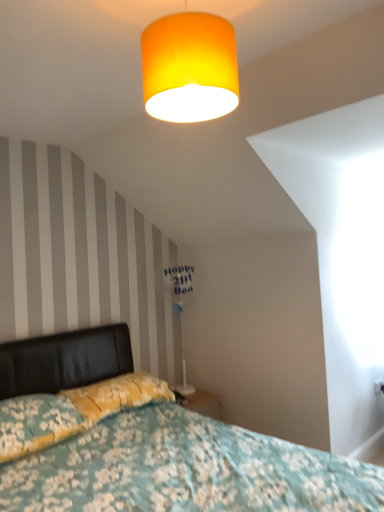
Describe the element at coordinates (117, 395) in the screenshot. I see `yellow floral fabric pillow at lower left, which appears as the first pillow when viewed from the back` at that location.

What is the approximate height of orange fabric lampshade at upper center?

42.25 centimeters.

Measure the distance between floral fabric bed at lower left and camera.

floral fabric bed at lower left and camera are 1.52 meters apart from each other.

The width and height of the screenshot is (384, 512). I want to click on yellow floral fabric pillow at lower left, which ranks as the 2th pillow in front-to-back order, so click(117, 395).

Choose the correct answer: Is orange fabric lampshade at upper center inside white plastic table lamp at center or outside it?

orange fabric lampshade at upper center is not enclosed by white plastic table lamp at center.

Who is taller, orange fabric lampshade at upper center or white plastic table lamp at center?

With more height is white plastic table lamp at center.

Is orange fabric lampshade at upper center wider than white plastic table lamp at center?

Yes.

Is white plastic table lamp at center inside the boundaries of orange fabric lampshade at upper center, or outside?

white plastic table lamp at center lies outside orange fabric lampshade at upper center.

Based on the photo, can you confirm if white plastic table lamp at center is positioned to the left of orange fabric lampshade at upper center?

Yes, white plastic table lamp at center is to the left of orange fabric lampshade at upper center.

Which is nearer, (x=173, y=280) or (x=217, y=26)?

Point (x=173, y=280) is positioned farther from the camera compared to point (x=217, y=26).

Is yellow floral fabric pillow at lower left, which appears as the first pillow when viewed from the back, located outside floral fabric bed at lower left?

No, yellow floral fabric pillow at lower left, which appears as the first pillow when viewed from the back, is inside or overlapping with floral fabric bed at lower left.

Based on the photo, from the image's perspective, would you say yellow floral fabric pillow at lower left, which appears as the first pillow when viewed from the back, is positioned over floral fabric bed at lower left?

Indeed, from the image's perspective, yellow floral fabric pillow at lower left, which appears as the first pillow when viewed from the back, is shown above floral fabric bed at lower left.

I want to click on pillow that is the 2nd object above the floral fabric bed at lower left (from a real-world perspective), so click(117, 395).

Based on the photo, from a real-world perspective, which object stands above the other?

yellow floral fabric pillow at lower left, which appears as the first pillow when viewed from the back, is physically above.

Based on their sizes in the image, would you say white plastic table lamp at center is bigger or smaller than floral fabric pillow at lower left, the 2th pillow when ordered from back to front?

Clearly, white plastic table lamp at center is larger in size than floral fabric pillow at lower left, the 2th pillow when ordered from back to front.

From a real-world perspective, count 2nd pillows downward from the white plastic table lamp at center and point to it. Please provide its 2D coordinates.

[(36, 423)]

Looking at this image, from the image's perspective, would you say white plastic table lamp at center is shown under floral fabric pillow at lower left, the 2th pillow when ordered from back to front?

No, from the image's perspective, white plastic table lamp at center is not beneath floral fabric pillow at lower left, the 2th pillow when ordered from back to front.

Which of these two, white plastic table lamp at center or floral fabric pillow at lower left, the 2th pillow when ordered from back to front, is wider?

With larger width is floral fabric pillow at lower left, the 2th pillow when ordered from back to front.

Considering the sizes of objects floral fabric bed at lower left and floral fabric pillow at lower left, which is the first pillow in front-to-back order, in the image provided, who is thinner, floral fabric bed at lower left or floral fabric pillow at lower left, which is the first pillow in front-to-back order,?

floral fabric pillow at lower left, which is the first pillow in front-to-back order, is thinner.

Does floral fabric bed at lower left appear on the left side of floral fabric pillow at lower left, which is the first pillow in front-to-back order?

No, floral fabric bed at lower left is not to the left of floral fabric pillow at lower left, which is the first pillow in front-to-back order.

Does point (78, 473) lie behind point (40, 414)?

No, it is not.

Is floral fabric pillow at lower left, the 2th pillow when ordered from back to front, directly adjacent to floral fabric bed at lower left?

No, floral fabric pillow at lower left, the 2th pillow when ordered from back to front, is not touching floral fabric bed at lower left.

From a real-world perspective, who is located lower, floral fabric pillow at lower left, the 2th pillow when ordered from back to front, or floral fabric bed at lower left?

floral fabric bed at lower left, from a real-world perspective.

Is floral fabric pillow at lower left, the 2th pillow when ordered from back to front, aimed at floral fabric bed at lower left?

Yes, floral fabric pillow at lower left, the 2th pillow when ordered from back to front, is aimed at floral fabric bed at lower left.

From the image's perspective, is floral fabric pillow at lower left, which is the first pillow in front-to-back order, located above or below floral fabric bed at lower left?

floral fabric pillow at lower left, which is the first pillow in front-to-back order, is situated higher than floral fabric bed at lower left in the image.

Considering the sizes of orange fabric lampshade at upper center and yellow floral fabric pillow at lower left, which appears as the first pillow when viewed from the back, in the image, is orange fabric lampshade at upper center bigger or smaller than yellow floral fabric pillow at lower left, which appears as the first pillow when viewed from the back,?

In the image, orange fabric lampshade at upper center appears to be smaller than yellow floral fabric pillow at lower left, which appears as the first pillow when viewed from the back.

What's the angular difference between orange fabric lampshade at upper center and yellow floral fabric pillow at lower left, which ranks as the 2th pillow in front-to-back order,'s facing directions?

5.6 degrees.

Is there a large distance between orange fabric lampshade at upper center and yellow floral fabric pillow at lower left, which ranks as the 2th pillow in front-to-back order?

Absolutely, orange fabric lampshade at upper center is distant from yellow floral fabric pillow at lower left, which ranks as the 2th pillow in front-to-back order.

In the scene shown: Would you say orange fabric lampshade at upper center is inside or outside yellow floral fabric pillow at lower left, which appears as the first pillow when viewed from the back?

orange fabric lampshade at upper center is located beyond the bounds of yellow floral fabric pillow at lower left, which appears as the first pillow when viewed from the back.

In order to click on lamp on the right side of white plastic table lamp at center in this screenshot , I will do `click(189, 68)`.

Where is `table lamp that appears on the left of orange fabric lampshade at upper center`? table lamp that appears on the left of orange fabric lampshade at upper center is located at coordinates (179, 303).

Which object lies nearer to the anchor point floral fabric pillow at lower left, the 2th pillow when ordered from back to front, white plastic table lamp at center or floral fabric bed at lower left?

Among the two, floral fabric bed at lower left is located nearer to floral fabric pillow at lower left, the 2th pillow when ordered from back to front.

When comparing their distances from orange fabric lampshade at upper center, does floral fabric bed at lower left or yellow floral fabric pillow at lower left, which appears as the first pillow when viewed from the back, seem closer?

Among the two, floral fabric bed at lower left is located nearer to orange fabric lampshade at upper center.

Considering their positions, is orange fabric lampshade at upper center positioned closer to yellow floral fabric pillow at lower left, which appears as the first pillow when viewed from the back, than floral fabric bed at lower left?

Among the two, floral fabric bed at lower left is located nearer to yellow floral fabric pillow at lower left, which appears as the first pillow when viewed from the back.

Based on their spatial positions, is white plastic table lamp at center or orange fabric lampshade at upper center closer to floral fabric pillow at lower left, which is the first pillow in front-to-back order?

The object closer to floral fabric pillow at lower left, which is the first pillow in front-to-back order, is white plastic table lamp at center.

Based on their spatial positions, is floral fabric bed at lower left or yellow floral fabric pillow at lower left, which ranks as the 2th pillow in front-to-back order, further from white plastic table lamp at center?

floral fabric bed at lower left is further to white plastic table lamp at center.

Considering their positions, is floral fabric bed at lower left positioned further to yellow floral fabric pillow at lower left, which appears as the first pillow when viewed from the back, than white plastic table lamp at center?

white plastic table lamp at center is further to yellow floral fabric pillow at lower left, which appears as the first pillow when viewed from the back.

Based on their spatial positions, is floral fabric bed at lower left or orange fabric lampshade at upper center closer to yellow floral fabric pillow at lower left, which appears as the first pillow when viewed from the back?

floral fabric bed at lower left is positioned closer to the anchor yellow floral fabric pillow at lower left, which appears as the first pillow when viewed from the back.

When comparing their distances from floral fabric pillow at lower left, the 2th pillow when ordered from back to front, does yellow floral fabric pillow at lower left, which ranks as the 2th pillow in front-to-back order, or floral fabric bed at lower left seem closer?

yellow floral fabric pillow at lower left, which ranks as the 2th pillow in front-to-back order, lies closer to floral fabric pillow at lower left, the 2th pillow when ordered from back to front, than the other object.

Identify the location of pillow between orange fabric lampshade at upper center and floral fabric pillow at lower left, the 2th pillow when ordered from back to front, from top to bottom. (117, 395).

Image resolution: width=384 pixels, height=512 pixels. What are the coordinates of `pillow located between floral fabric bed at lower left and yellow floral fabric pillow at lower left, which appears as the first pillow when viewed from the back, in the depth direction` in the screenshot? It's located at (36, 423).

This screenshot has width=384, height=512. I want to click on pillow positioned between floral fabric pillow at lower left, the 2th pillow when ordered from back to front, and white plastic table lamp at center from near to far, so click(x=117, y=395).

In order to click on lamp located between floral fabric bed at lower left and yellow floral fabric pillow at lower left, which appears as the first pillow when viewed from the back, in the depth direction in this screenshot , I will do `click(189, 68)`.